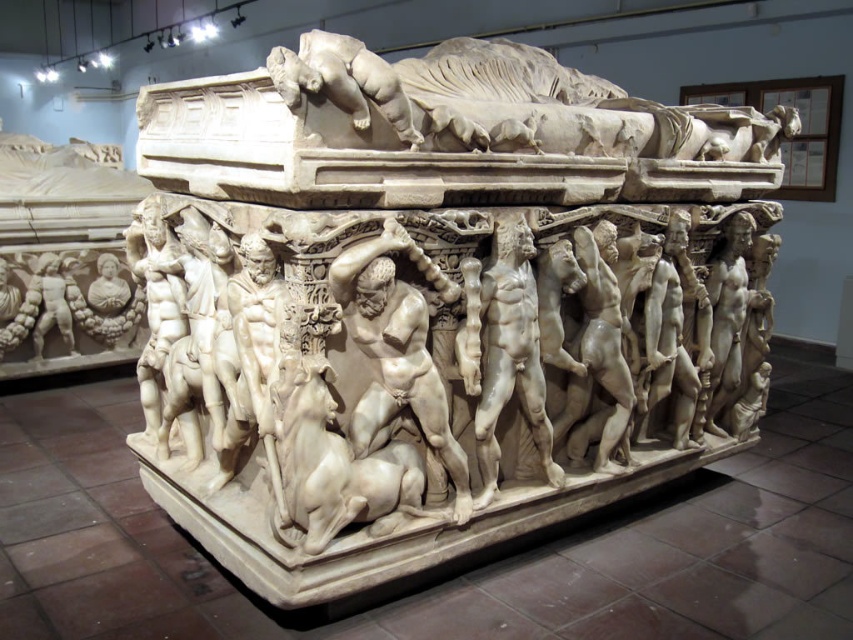
Question: Estimate the real-world distances between objects in this image. Which object is closer to the white marble sarcophagus at upper center?

Choices:
 (A) white marble/stone bull at center
 (B) white marble sarcophagus at center
 (C) white marble muscular man at center
 (D) white marble man at center

Answer: (B)

Question: Can you confirm if white marble/stone bull at center is positioned to the right of white marble man at center?

Choices:
 (A) no
 (B) yes

Answer: (A)

Question: Which point is farther to the camera?

Choices:
 (A) (289, 54)
 (B) (630, 241)
 (C) (524, 348)

Answer: (B)

Question: Is white marble muscular man at center closer to the viewer compared to white marble/stone bull at center?

Choices:
 (A) no
 (B) yes

Answer: (A)

Question: Is white marble muscular man at center to the right of smooth white figure at lower left from the viewer's perspective?

Choices:
 (A) no
 (B) yes

Answer: (B)

Question: Which point appears farthest from the camera in this image?

Choices:
 (A) (483, 211)
 (B) (56, 308)

Answer: (B)